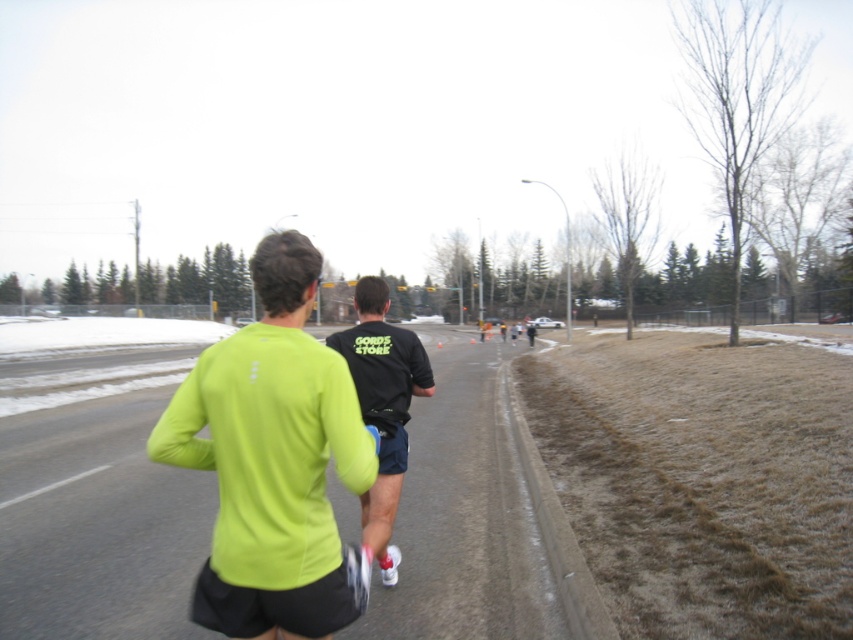
Question: Does neon green fabric shirt at center have a smaller size compared to black matte t-shirt at center?

Choices:
 (A) no
 (B) yes

Answer: (A)

Question: Which point is farther from the camera taking this photo?

Choices:
 (A) (305, 320)
 (B) (370, 280)

Answer: (B)

Question: Which point is closer to the camera?

Choices:
 (A) neon green fabric shirt at center
 (B) black matte t-shirt at center

Answer: (A)

Question: From the image, what is the correct spatial relationship of neon green fabric shirt at center in relation to black matte t-shirt at center?

Choices:
 (A) below
 (B) above

Answer: (A)

Question: Observing the image, what is the correct spatial positioning of neon green fabric shirt at center in reference to black matte t-shirt at center?

Choices:
 (A) left
 (B) right

Answer: (A)